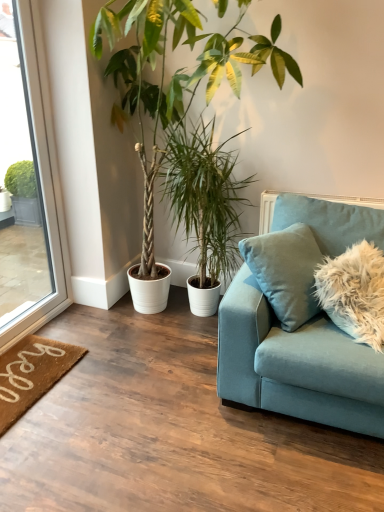
Identify the location of vacant space to the left of teal velvet couch at right. The height and width of the screenshot is (512, 384). (149, 411).